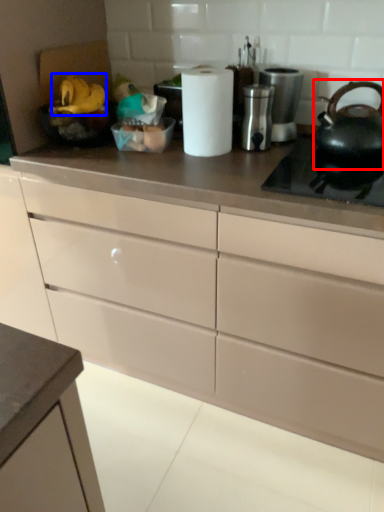
Question: Which object is closer to the camera taking this photo, tea pot (highlighted by a red box) or food (highlighted by a blue box)?

Choices:
 (A) tea pot
 (B) food

Answer: (A)